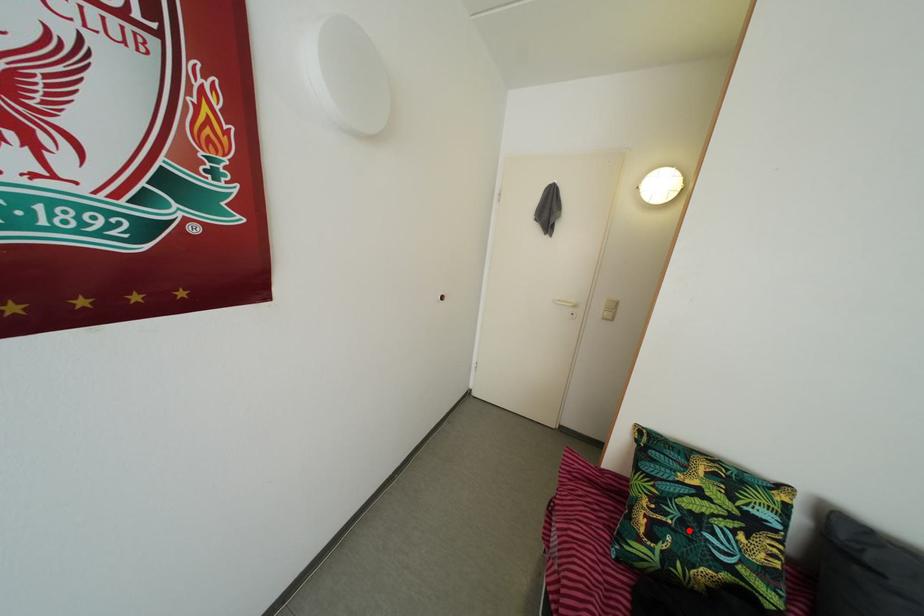
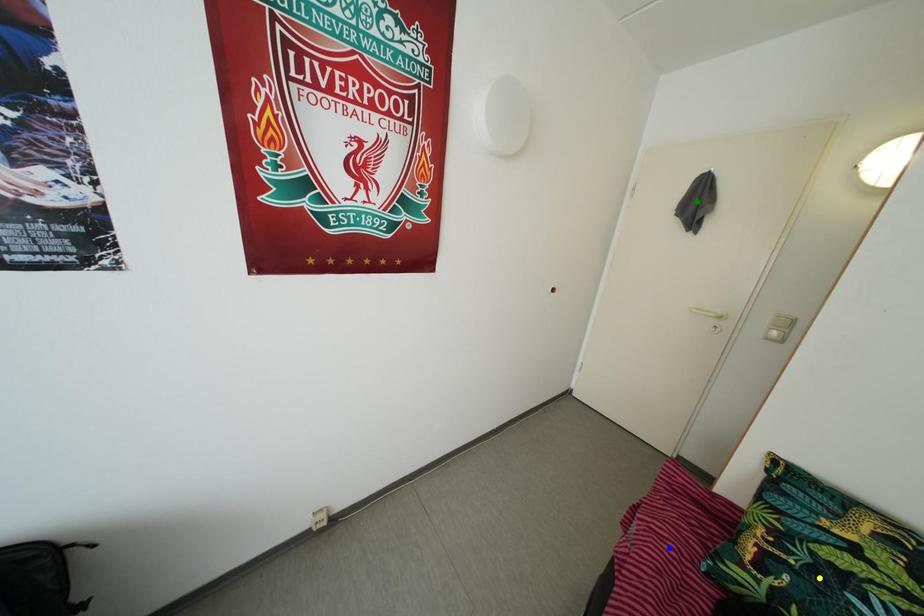
Question: I am providing you with two images of the same scene from different viewpoints. A red point is marked on the first image. You are given multiple points on the second image. Which spot in image 2 lines up with the point in image 1?

Choices:
 (A) green point
 (B) blue point
 (C) yellow point

Answer: (C)